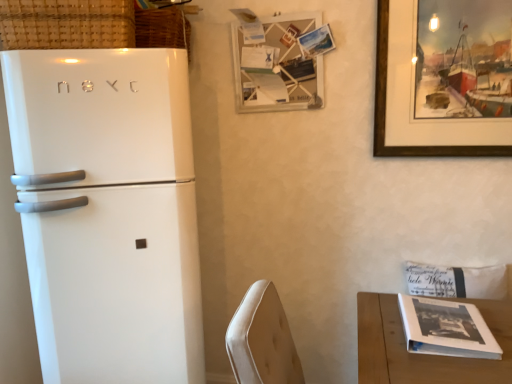
Question: From the image's perspective, relative to white glossy refrigerator at left, is woven straw basket at upper left, marked as the 2th basket in a front-to-back arrangement, above or below?

Choices:
 (A) above
 (B) below

Answer: (A)

Question: From a real-world perspective, is woven straw basket at upper left, marked as the 2th basket in a front-to-back arrangement, above or below white glossy refrigerator at left?

Choices:
 (A) below
 (B) above

Answer: (B)

Question: Which object is the farthest from the wooden picture frame at upper center, the 1th picture frame from the left?

Choices:
 (A) white glossy refrigerator at left
 (B) wooden framed painting at upper right, acting as the second picture frame starting from the left
 (C) woven straw basket at upper left, the first basket viewed from the back
 (D) white wood table at lower right
 (E) woven wicker basket at upper left, the 1th basket in the front-to-back sequence

Answer: (D)

Question: Considering the real-world distances, which object is farthest from the white glossy refrigerator at left?

Choices:
 (A) woven straw basket at upper left, marked as the 2th basket in a front-to-back arrangement
 (B) wooden picture frame at upper center, the 1th picture frame from the left
 (C) woven wicker basket at upper left, the second basket from the back
 (D) wooden framed painting at upper right, acting as the second picture frame starting from the left
 (E) white wood table at lower right

Answer: (D)